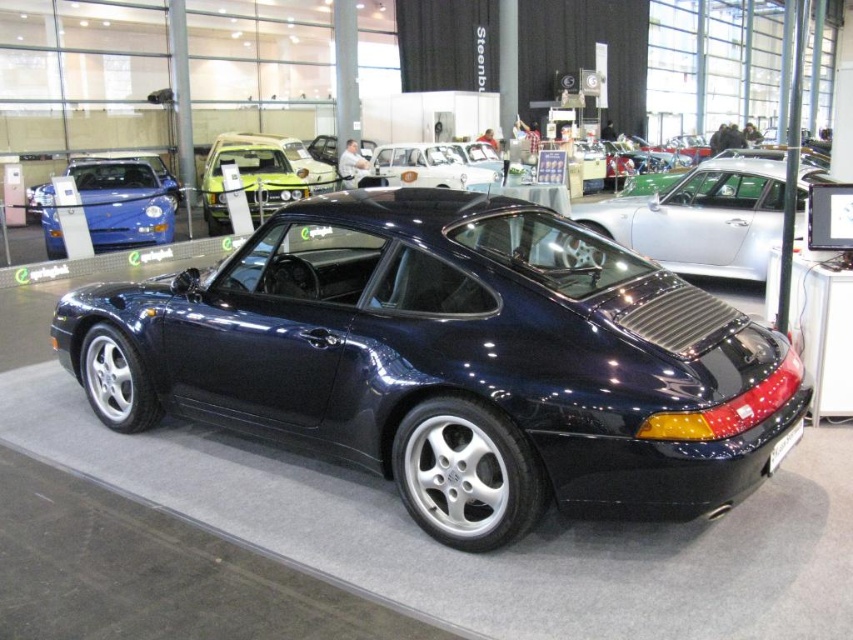
Is satin silver sedan at center thinner than matte green car at center?

No.

Image resolution: width=853 pixels, height=640 pixels. In order to click on satin silver sedan at center in this screenshot , I will do pyautogui.click(x=701, y=218).

Between matte blue sedan at left and black plastic license plate at rear, which one is positioned lower?

black plastic license plate at rear

Which is more to the left, matte blue sedan at left or black plastic license plate at rear?

matte blue sedan at left

Is point (120, 182) less distant than point (793, 440)?

No.

What are the coordinates of `matte blue sedan at left` in the screenshot? It's located at (125, 200).

Between glossy dark blue car at center and matte green car at center, which one appears on the left side from the viewer's perspective?

From the viewer's perspective, matte green car at center appears more on the left side.

Does glossy dark blue car at center have a lesser height compared to matte green car at center?

Indeed, glossy dark blue car at center has a lesser height compared to matte green car at center.

The image size is (853, 640). What do you see at coordinates (451, 358) in the screenshot? I see `glossy dark blue car at center` at bounding box center [451, 358].

This screenshot has height=640, width=853. I want to click on glossy dark blue car at center, so click(451, 358).